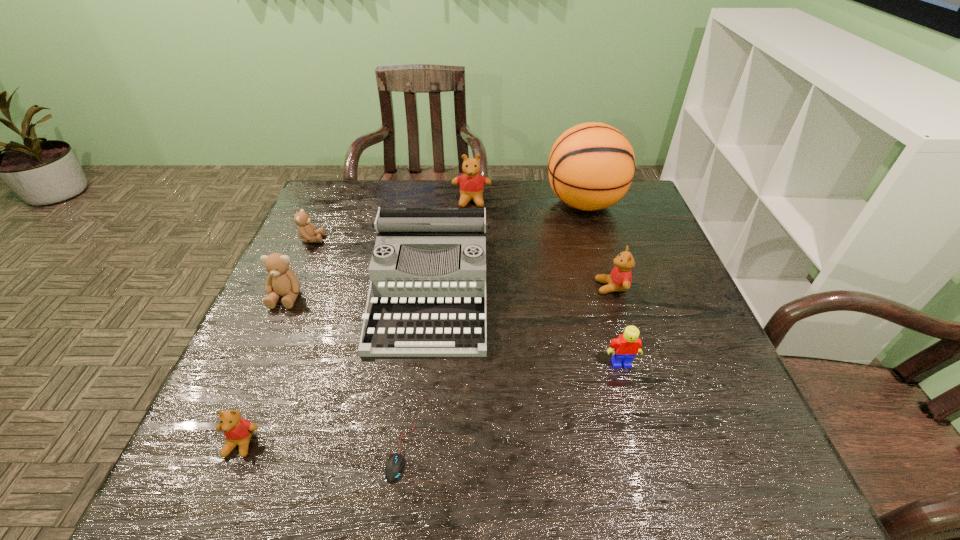
This screenshot has width=960, height=540. I want to click on vacant space located on the front-facing side of the second nearest red teddy bear, so pos(517,287).

Identify the location of free spot located on the front-facing side of the second nearest red teddy bear. Image resolution: width=960 pixels, height=540 pixels. (458, 287).

At what (x,y) coordinates should I click in order to perform the action: click on free location located 0.160m on the face of the nearer brown teddy bear. Please return your answer as a coordinate pair (x, y). The width and height of the screenshot is (960, 540). Looking at the image, I should click on (255, 365).

Find the location of a particular element. Image resolution: width=960 pixels, height=540 pixels. vacant region located 0.150m on the front-facing side of the seventh farthest object is located at coordinates (641, 435).

Locate an element on the screen. The width and height of the screenshot is (960, 540). vacant region located on the face of the smaller brown teddy bear is located at coordinates (464, 239).

The width and height of the screenshot is (960, 540). Identify the location of blank area located 0.360m on the back of the mouse. (421, 291).

Find the location of `basketball that is positioned at the far edge`. basketball that is positioned at the far edge is located at coordinates (591, 166).

Where is `teddy bear at the far edge`? teddy bear at the far edge is located at coordinates (471, 184).

Find the location of a particular element. teddy bear that is at the near edge is located at coordinates (238, 431).

The width and height of the screenshot is (960, 540). Identify the location of mouse that is at the near edge. [395, 463].